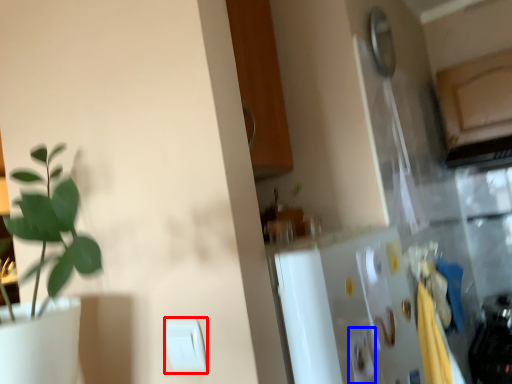
Question: Which of the following is the farthest to the observer, light switch (highlighted by a red box) or light switch (highlighted by a blue box)?

Choices:
 (A) light switch
 (B) light switch

Answer: (B)